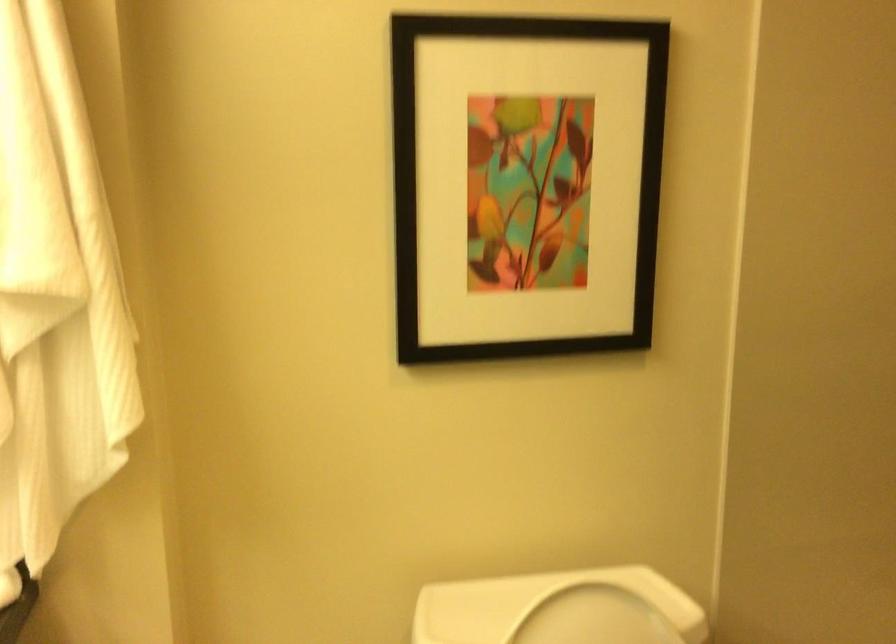
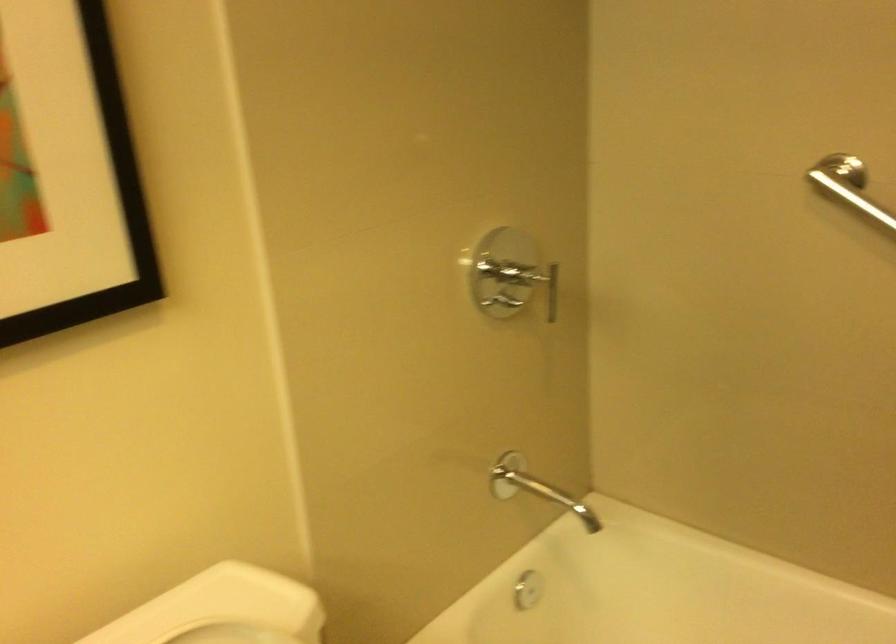
Question: The camera is either moving clockwise (left) or counter-clockwise (right) around the object. The first image is from the beginning of the video and the second image is from the end. Is the camera moving left or right when shooting the video?

Choices:
 (A) Left
 (B) Right

Answer: (A)